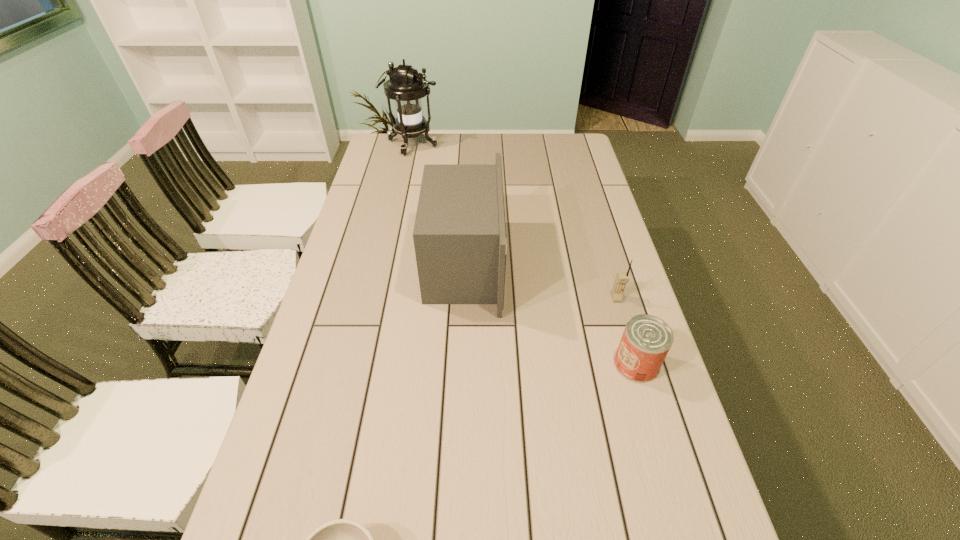
Locate an element on the screen. The width and height of the screenshot is (960, 540). the farthest object is located at coordinates click(406, 86).

This screenshot has height=540, width=960. Find the location of `the tallest object`. the tallest object is located at coordinates (406, 86).

This screenshot has width=960, height=540. What are the coordinates of `microwave oven` in the screenshot? It's located at (459, 234).

Locate an element on the screen. the third object from right to left is located at coordinates (459, 234).

What are the coordinates of `cellular telephone` in the screenshot? It's located at (622, 278).

I want to click on the fourth tallest object, so click(x=646, y=340).

What are the coordinates of `the second nearest object` in the screenshot? It's located at (646, 340).

The width and height of the screenshot is (960, 540). I want to click on vacant space located on the front of the lantern, so click(x=405, y=179).

I want to click on free space located on the front-facing side of the second tallest object, so click(607, 265).

The height and width of the screenshot is (540, 960). Identify the location of free space located 0.320m on the front of the cellular telephone, where the keypad is located. (648, 406).